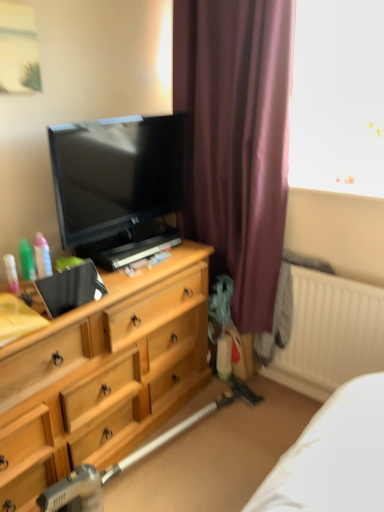
The width and height of the screenshot is (384, 512). Find the location of `vacant region to the right of metallic silver vacuum cleaner at lower center`. vacant region to the right of metallic silver vacuum cleaner at lower center is located at coordinates (240, 456).